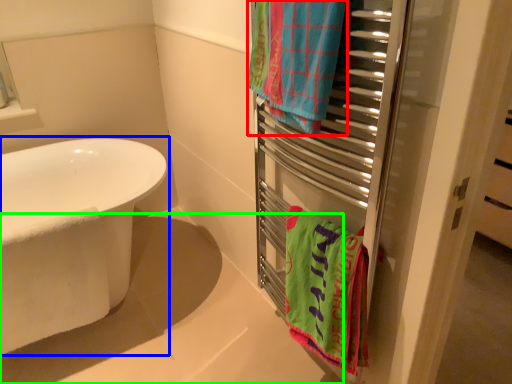
Question: Based on their relative distances, which object is farther from towel/napkin (highlighted by a red box)? Choose from bathtub (highlighted by a blue box) and bath (highlighted by a green box).

Choices:
 (A) bathtub
 (B) bath

Answer: (B)